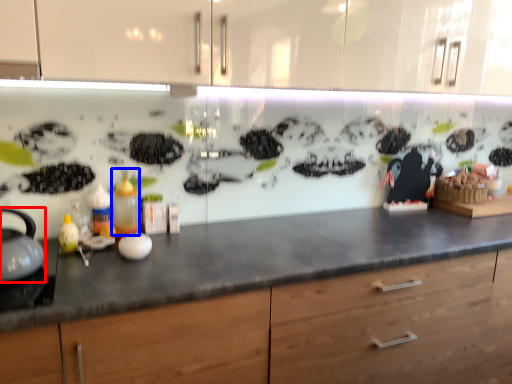
Question: Which object appears closest to the camera in this image, tea pot (highlighted by a red box) or bottle (highlighted by a blue box)?

Choices:
 (A) tea pot
 (B) bottle

Answer: (A)